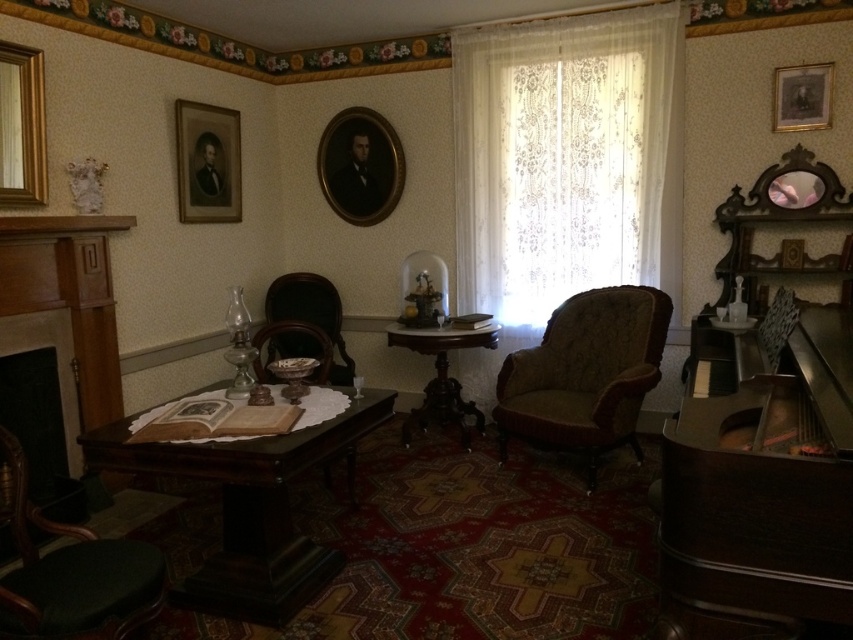
In the scene shown: Who is higher up, white lace curtain at center or gold-framed portrait at center?

gold-framed portrait at center is higher up.

Can you confirm if white lace curtain at center is positioned below gold-framed portrait at center?

Yes, white lace curtain at center is below gold-framed portrait at center.

Where is `white lace curtain at center`? white lace curtain at center is located at coordinates (566, 160).

Based on the photo, does velvet brown armchair at center have a greater width compared to gold-framed portrait at upper right?

Yes, velvet brown armchair at center is wider than gold-framed portrait at upper right.

In the scene shown: Can you confirm if velvet brown armchair at center is shorter than gold-framed portrait at upper right?

In fact, velvet brown armchair at center may be taller than gold-framed portrait at upper right.

Is point (538, 420) behind point (821, 113)?

No, it is in front of (821, 113).

What are the coordinates of `velvet brown armchair at center` in the screenshot? It's located at (585, 372).

Does velvet brown armchair at center come behind gold metallic picture frame at upper left?

Yes, it is.

This screenshot has height=640, width=853. Describe the element at coordinates (585, 372) in the screenshot. I see `velvet brown armchair at center` at that location.

In order to click on velvet brown armchair at center in this screenshot , I will do `click(585, 372)`.